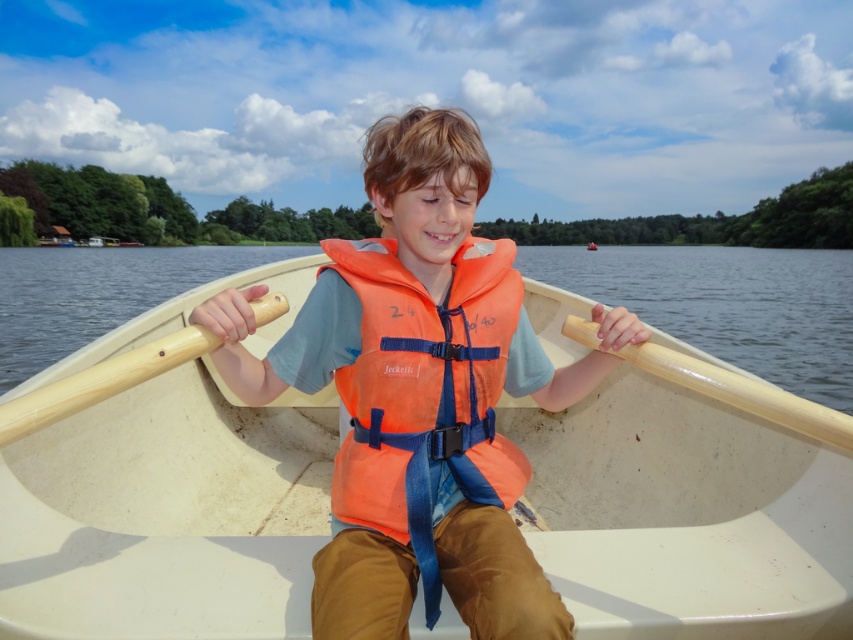
Is transparent water at center further to the viewer compared to wooden paddle at left?

That is True.

Which of these two, transparent water at center or wooden paddle at left, stands taller?

transparent water at center

Is point (837, 262) in front of point (9, 413)?

No, it is behind (9, 413).

What are the coordinates of `transparent water at center` in the screenshot? It's located at (728, 305).

Which is below, orange life vest at center or transparent water at center?

Positioned lower is orange life vest at center.

Is point (399, 570) positioned after point (149, 253)?

That is False.

Where is `orange life vest at center`? orange life vest at center is located at coordinates (416, 396).

Who is positioned more to the right, orange life vest at center or wooden paddle at left?

Positioned to the right is orange life vest at center.

This screenshot has width=853, height=640. What do you see at coordinates (416, 396) in the screenshot?
I see `orange life vest at center` at bounding box center [416, 396].

Where is `orange life vest at center`? This screenshot has width=853, height=640. orange life vest at center is located at coordinates (416, 396).